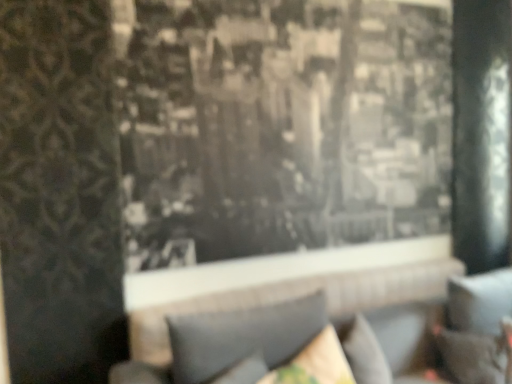
Question: Is velvet dark brown pillow at lower right, which ranks as the first pillow in right-to-left order, positioned far away from velvet beige pillow at lower center, arranged as the 2th pillow when viewed from the left?

Choices:
 (A) no
 (B) yes

Answer: (A)

Question: Does velvet dark brown pillow at lower right, which ranks as the first pillow in right-to-left order, appear on the left side of velvet beige pillow at lower center, arranged as the 2th pillow when viewed from the left?

Choices:
 (A) no
 (B) yes

Answer: (A)

Question: Can you confirm if velvet dark brown pillow at lower right, the third pillow positioned from the left, is thinner than velvet beige pillow at lower center, arranged as the 2th pillow when viewed from the left?

Choices:
 (A) no
 (B) yes

Answer: (A)

Question: Can you confirm if velvet dark brown pillow at lower right, which ranks as the first pillow in right-to-left order, is taller than velvet beige pillow at lower center, arranged as the 2th pillow when viewed from the left?

Choices:
 (A) no
 (B) yes

Answer: (B)

Question: Would you say velvet dark brown pillow at lower right, the third pillow positioned from the left, contains velvet beige pillow at lower center, arranged as the 2th pillow when viewed from the left?

Choices:
 (A) no
 (B) yes

Answer: (A)

Question: Considering the relative positions of gray fabric couch at center and velvet beige pillow at lower center, the second pillow in the right-to-left sequence, in the image provided, is gray fabric couch at center to the left or to the right of velvet beige pillow at lower center, the second pillow in the right-to-left sequence,?

Choices:
 (A) right
 (B) left

Answer: (A)

Question: From a real-world perspective, relative to velvet beige pillow at lower center, the second pillow in the right-to-left sequence, is gray fabric couch at center vertically above or below?

Choices:
 (A) below
 (B) above

Answer: (A)

Question: From the image's perspective, is gray fabric couch at center located above or below velvet beige pillow at lower center, arranged as the 2th pillow when viewed from the left?

Choices:
 (A) above
 (B) below

Answer: (B)

Question: Does point (454, 296) appear closer or farther from the camera than point (330, 350)?

Choices:
 (A) closer
 (B) farther

Answer: (B)

Question: From a real-world perspective, is black textured fabric at center physically located above or below velvet beige pillow at lower center, arranged as the 2th pillow when viewed from the left?

Choices:
 (A) below
 (B) above

Answer: (B)

Question: Considering the positions of black textured fabric at center and velvet beige pillow at lower center, the second pillow in the right-to-left sequence, in the image, is black textured fabric at center wider or thinner than velvet beige pillow at lower center, the second pillow in the right-to-left sequence,?

Choices:
 (A) thin
 (B) wide

Answer: (A)

Question: Considering the positions of point (279, 147) and point (345, 382), is point (279, 147) closer or farther from the camera than point (345, 382)?

Choices:
 (A) farther
 (B) closer

Answer: (A)

Question: Considering the positions of black textured fabric at center and velvet beige pillow at lower center, the second pillow in the right-to-left sequence, in the image, is black textured fabric at center taller or shorter than velvet beige pillow at lower center, the second pillow in the right-to-left sequence,?

Choices:
 (A) short
 (B) tall

Answer: (B)

Question: In terms of height, does gray fabric couch at center look taller or shorter compared to textured gray pillow at lower center, placed as the 3th pillow when sorted from right to left?

Choices:
 (A) short
 (B) tall

Answer: (B)

Question: Considering the relative positions of gray fabric couch at center and textured gray pillow at lower center, which is the 1th pillow from left to right, in the image provided, is gray fabric couch at center to the left or to the right of textured gray pillow at lower center, which is the 1th pillow from left to right,?

Choices:
 (A) left
 (B) right

Answer: (B)